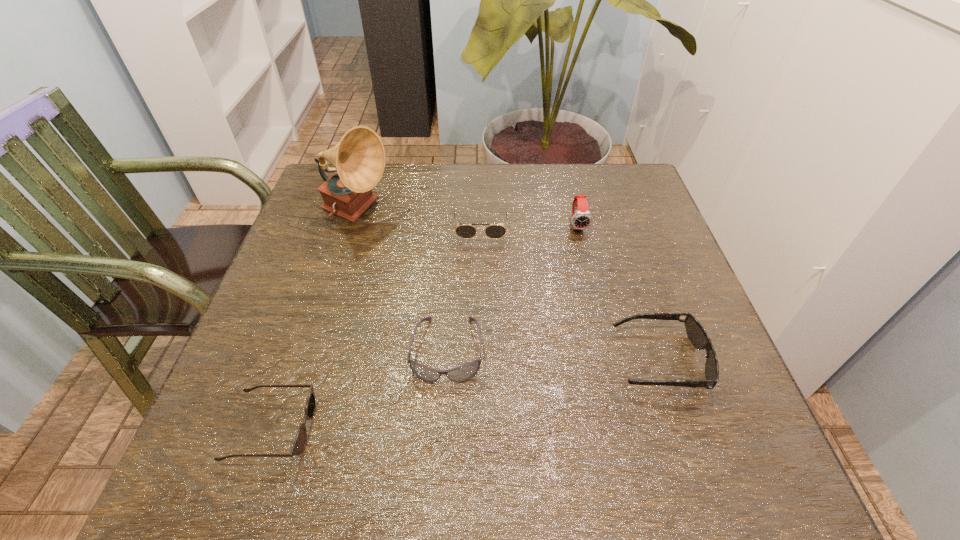
Choose which sunglasses is the nearest neighbor to the rightmost sunglasses. Please provide its 2D coordinates. Your answer should be formatted as a tuple, i.e. [(x, y)], where the tuple contains the x and y coordinates of a point satisfying the conditions above.

[(465, 372)]